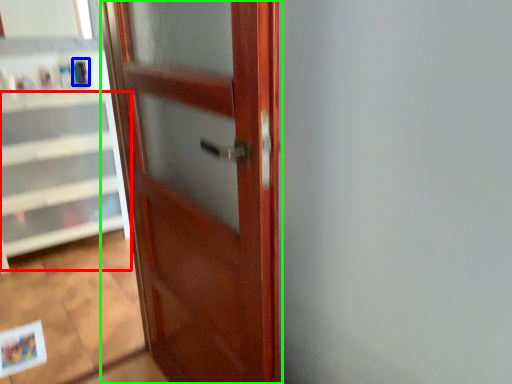
Question: Estimate the real-world distances between objects in this image. Which object is farther from cabinetry (highlighted by a red box), toiletry (highlighted by a blue box) or door (highlighted by a green box)?

Choices:
 (A) toiletry
 (B) door

Answer: (B)